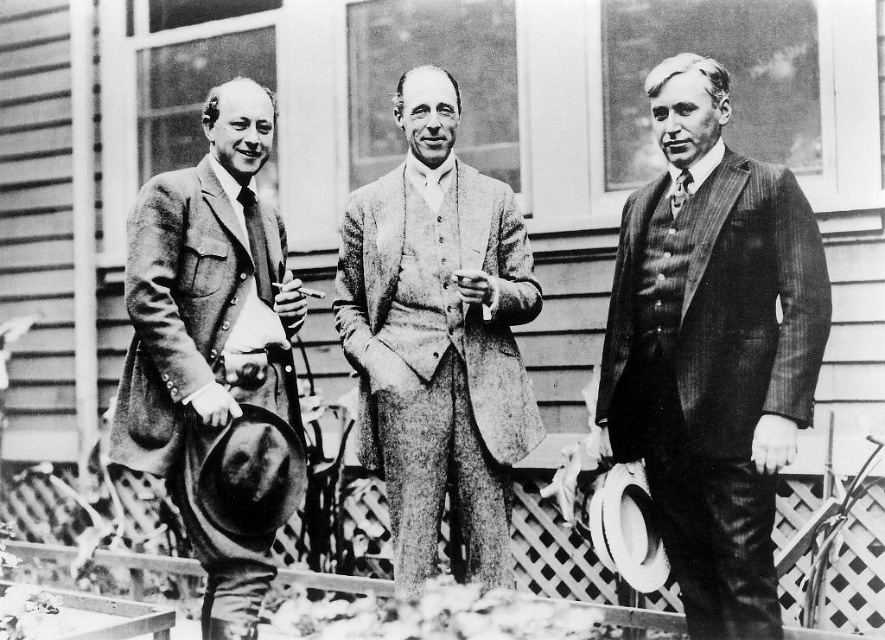
You are a photographer analyzing this image. You notice two points marked in the scene. The first point is at coordinates point (291, 392) and the second is at point (676, 180). Which of these points is closer to the camera lens?

Point (291, 392) is closer to the camera lens than point (676, 180).